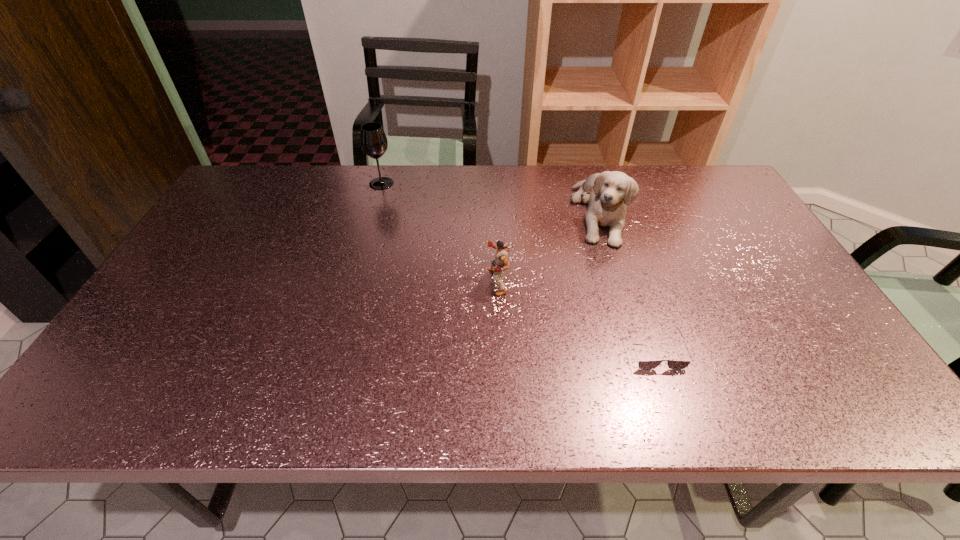
This screenshot has width=960, height=540. Identify the location of free spot between the nearest object and the second tallest object. (627, 281).

Where is `free space between the puppy and the wineglass`? This screenshot has width=960, height=540. free space between the puppy and the wineglass is located at coordinates (491, 198).

In order to click on vacant region between the wineglass and the second tallest object in this screenshot , I will do `click(491, 198)`.

Where is `empty space between the sunglasses and the second nearest object`? This screenshot has width=960, height=540. empty space between the sunglasses and the second nearest object is located at coordinates (576, 316).

Identify the location of free spot between the shortest object and the third tallest object. The height and width of the screenshot is (540, 960). click(576, 316).

Locate an element on the screen. The height and width of the screenshot is (540, 960). free space between the third object from right to left and the shortest object is located at coordinates (576, 316).

Where is `vacant point located between the third shortest object and the second shortest object`? Image resolution: width=960 pixels, height=540 pixels. vacant point located between the third shortest object and the second shortest object is located at coordinates (548, 247).

The width and height of the screenshot is (960, 540). Find the location of `free space between the leftmost object and the sunglasses`. free space between the leftmost object and the sunglasses is located at coordinates (518, 267).

Identify the location of free space that is in between the nearest object and the third shortest object. (627, 281).

Locate an element on the screen. free point between the shortest object and the wineglass is located at coordinates (518, 267).